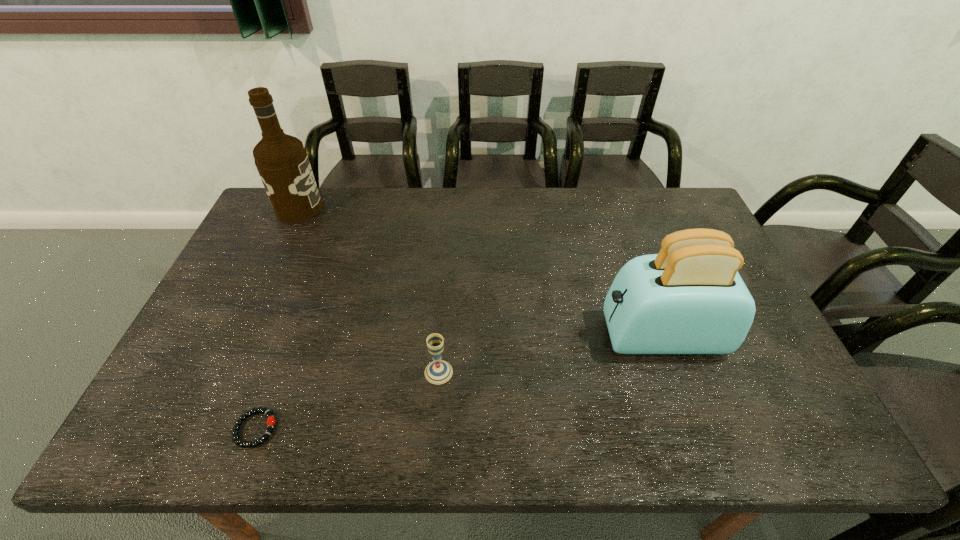
At what (x,y) coordinates should I click in order to perform the action: click on free space that satisfies the following two spatial constraints: 1. on the label of the second object from right to left; 2. on the right side of the leftmost object. Please return your answer as a coordinate pair (x, y). The height and width of the screenshot is (540, 960). Looking at the image, I should click on (224, 372).